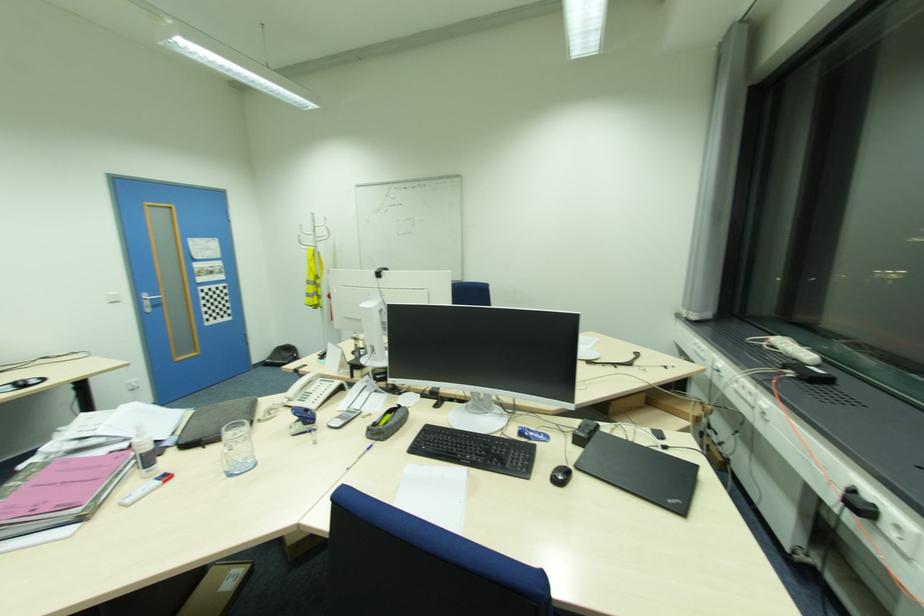
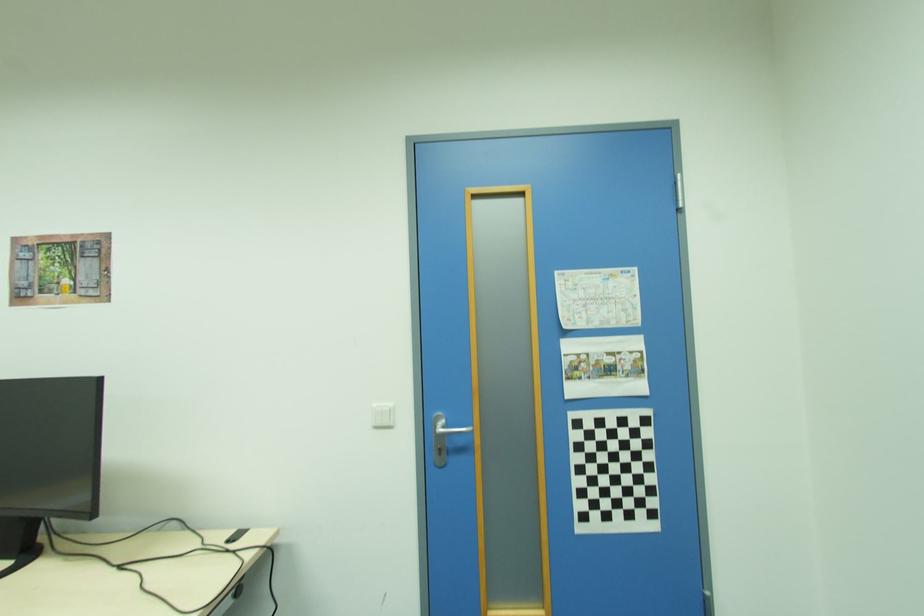
In the second image, find the point that corresponds to (x=148, y=300) in the first image.

(439, 429)